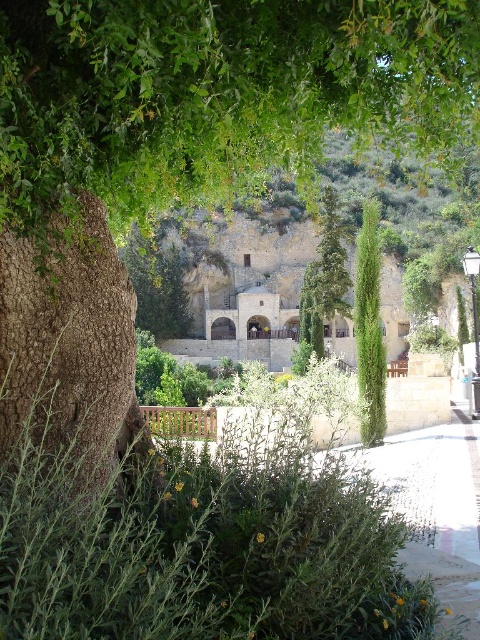
Question: Observing the image, what is the correct spatial positioning of brown wooden bench at lower center in reference to green textured cypress at center?

Choices:
 (A) right
 (B) left

Answer: (B)

Question: Can you confirm if brown wooden bench at lower center is thinner than green textured cypress at center?

Choices:
 (A) yes
 (B) no

Answer: (B)

Question: Observing the image, what is the correct spatial positioning of brown wooden bench at lower center in reference to green textured cypress at center?

Choices:
 (A) right
 (B) left

Answer: (B)

Question: Which point is farther from the camera taking this photo?

Choices:
 (A) (359, 253)
 (B) (263, 456)

Answer: (A)